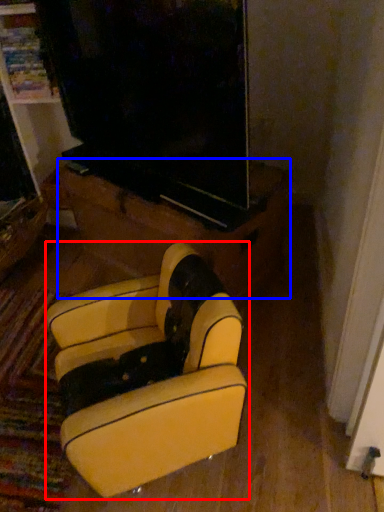
Question: Which object appears closest to the camera in this image, furniture (highlighted by a red box) or furniture (highlighted by a blue box)?

Choices:
 (A) furniture
 (B) furniture

Answer: (A)